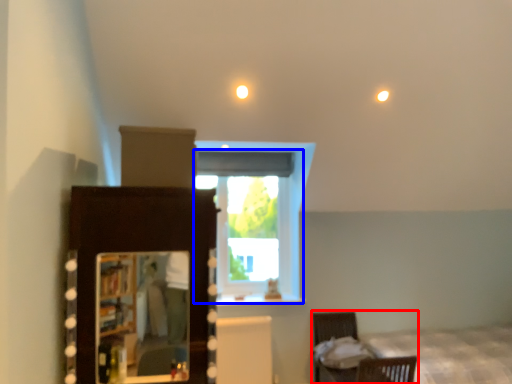
Question: Among these objects, which one is farthest to the camera, furniture (highlighted by a red box) or window (highlighted by a blue box)?

Choices:
 (A) furniture
 (B) window

Answer: (B)